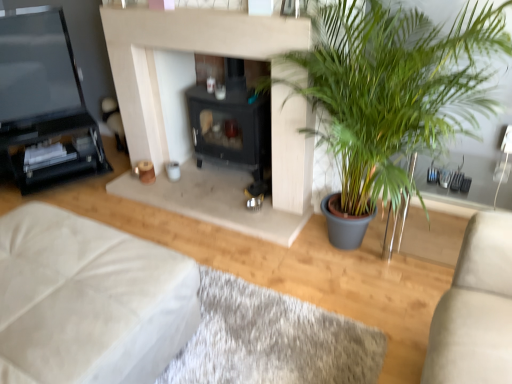
I want to click on free space above white fabric ottoman at lower left (from a real-world perspective), so click(66, 261).